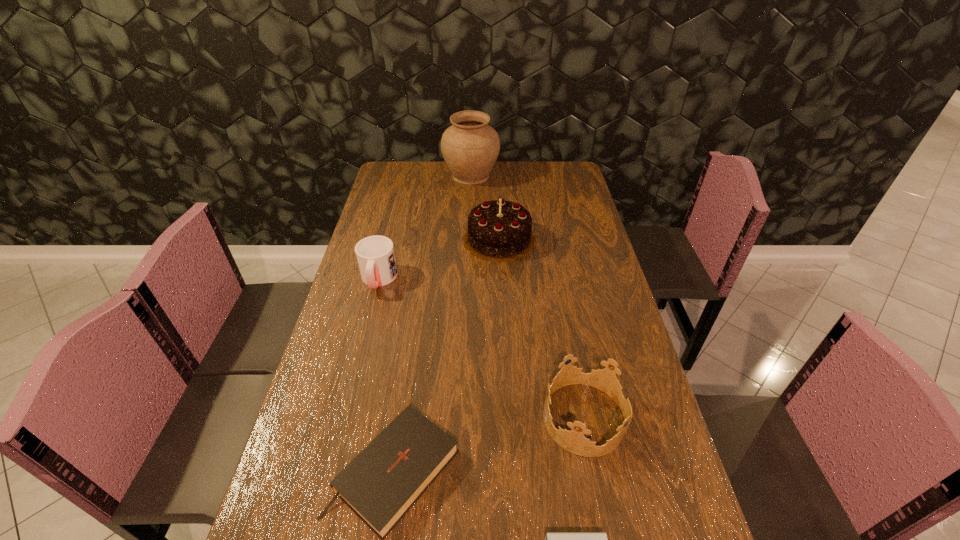
You are a GUI agent. You are given a task and a screenshot of the screen. Output one action in this format:
    pyautogui.click(x=<x>, y=<y>)
    Task: Click on the tallest object
    
    Given the screenshot: What is the action you would take?
    pyautogui.click(x=470, y=147)

Locate an element on the screen. the farthest object is located at coordinates (470, 147).

You are a GUI agent. You are given a task and a screenshot of the screen. Output one action in this format:
    pyautogui.click(x=<x>, y=<y>)
    Task: Click on the second tallest object
    
    Given the screenshot: What is the action you would take?
    pyautogui.click(x=500, y=231)

Image resolution: width=960 pixels, height=540 pixels. What are the coordinates of `birthday cake` in the screenshot? It's located at (500, 231).

I want to click on tiara, so click(574, 441).

This screenshot has height=540, width=960. Identify the location of the third farthest object. (375, 255).

Identify the location of vacant space located on the front of the farthest object. The height and width of the screenshot is (540, 960). (470, 206).

Locate an element on the screen. The width and height of the screenshot is (960, 540). free space located on the right of the fifth shortest object is located at coordinates (586, 239).

Find the location of a particular element. The image size is (960, 540). vacant space situated 0.350m on the front-facing side of the tiara is located at coordinates (397, 418).

Where is `free space located 0.080m on the front-facing side of the tiara`? This screenshot has height=540, width=960. free space located 0.080m on the front-facing side of the tiara is located at coordinates (510, 418).